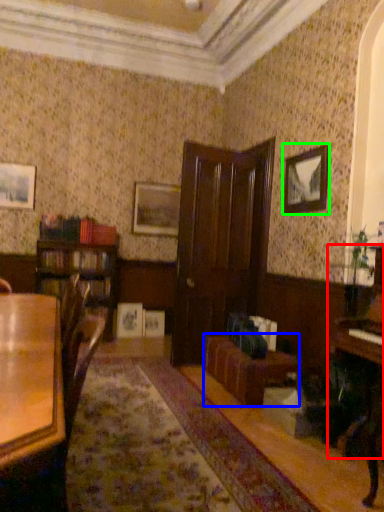
Question: Considering the real-world distances, which object is closest to piano (highlighted by a red box)? couch (highlighted by a blue box) or picture frame (highlighted by a green box).

Choices:
 (A) couch
 (B) picture frame

Answer: (A)